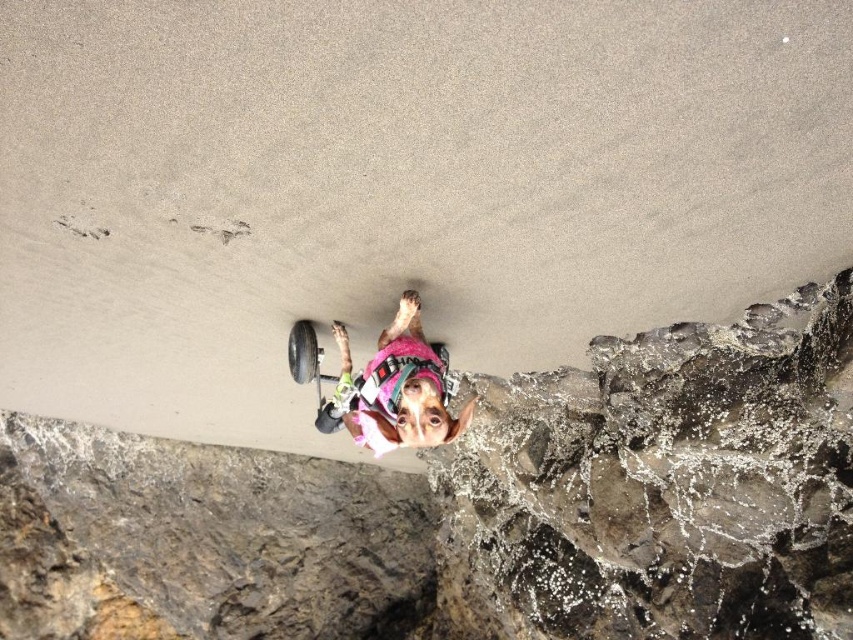
Question: Can you confirm if rough stone wall at lower right is bigger than pink fabric dog at center?

Choices:
 (A) yes
 (B) no

Answer: (A)

Question: Which object is closer to the camera taking this photo?

Choices:
 (A) pink fabric dog at center
 (B) rough stone wall at lower right

Answer: (A)

Question: Is rough stone wall at lower right below pink fabric dog at center?

Choices:
 (A) yes
 (B) no

Answer: (A)

Question: Can you confirm if rough stone wall at lower right is positioned to the right of pink fabric dog at center?

Choices:
 (A) yes
 (B) no

Answer: (A)